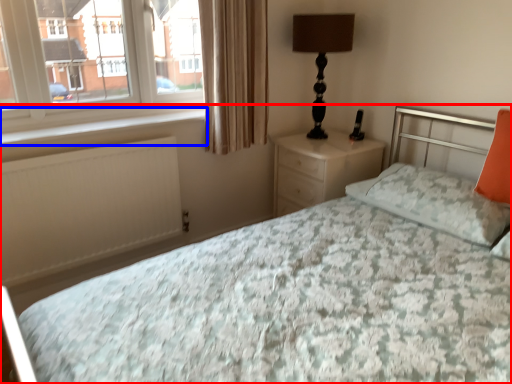
Question: Which point is further to the camera, bed (highlighted by a red box) or window sill (highlighted by a blue box)?

Choices:
 (A) bed
 (B) window sill

Answer: (B)